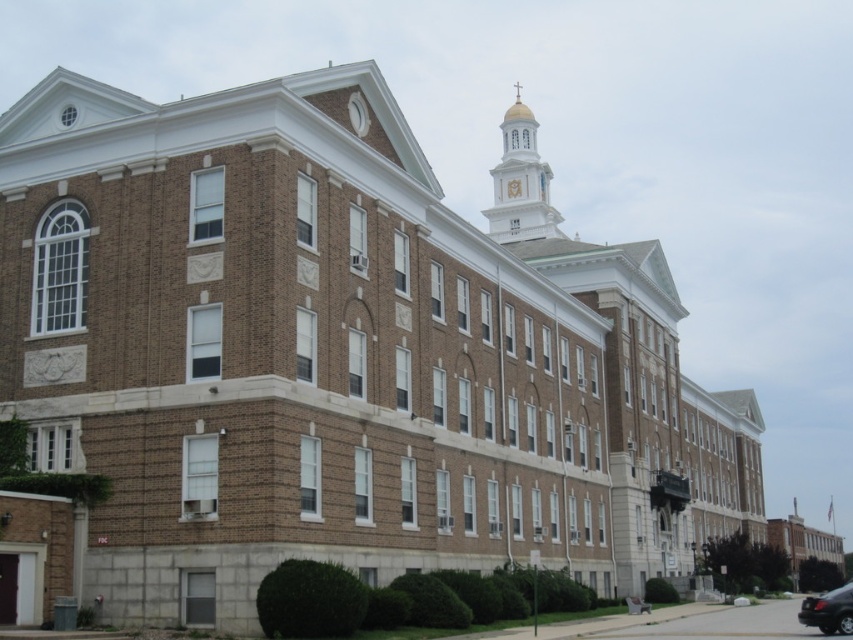
In the scene shown: You are a photographer standing in front of the building. You want to capture a photo that includes both the white glossy bell tower at upper center and the shiny black car at lower right. Which object will appear larger in the photo?

The white glossy bell tower at upper center will appear larger in the photo because it is much taller than the shiny black car at lower right.

You are standing in front of the building and want to locate the shiny black car at lower right. Which direction should you turn to see the white glossy bell tower at upper center?

The white glossy bell tower at upper center is to the left of the shiny black car at lower right, so you should turn to your left to see it.

You are standing in front of the building and want to locate the white glossy bell tower at upper center. According to the coordinates provided, where exactly should you look on the building?

The white glossy bell tower at upper center is located at the coordinates point (520,180) on the building.